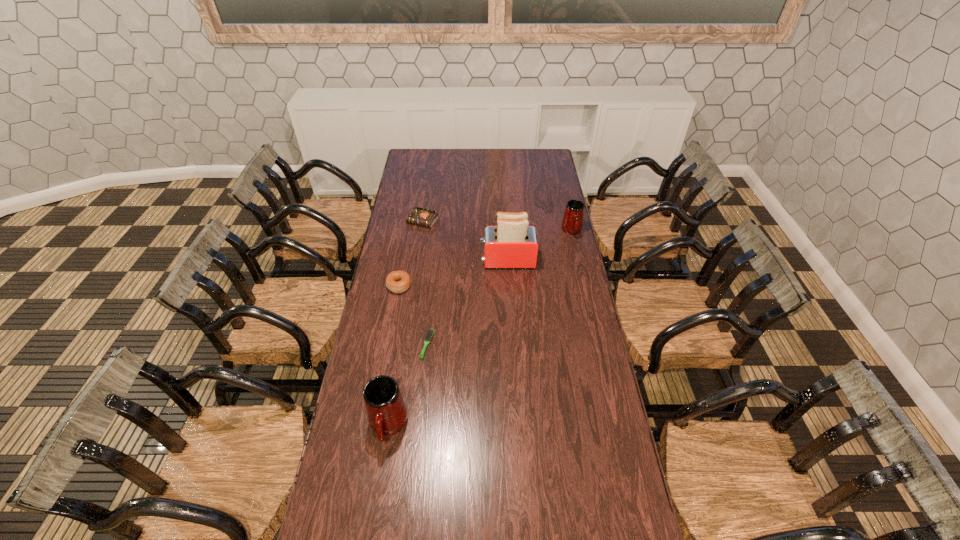
Find the location of a particular element. the nearer mug is located at coordinates (387, 414).

Find the location of a particular element. the second tallest object is located at coordinates (387, 414).

This screenshot has height=540, width=960. What are the coordinates of `the shorter mug` in the screenshot? It's located at (572, 223).

The height and width of the screenshot is (540, 960). I want to click on the farther mug, so click(572, 223).

This screenshot has width=960, height=540. Identify the location of toaster. (512, 244).

Image resolution: width=960 pixels, height=540 pixels. What are the coordinates of `the tallest object` in the screenshot? It's located at (512, 244).

Locate an element on the screen. diary is located at coordinates (419, 216).

Locate an element on the screen. This screenshot has height=540, width=960. bagel is located at coordinates (397, 281).

Image resolution: width=960 pixels, height=540 pixels. In order to click on the fifth farthest object in this screenshot , I will do `click(429, 333)`.

The image size is (960, 540). I want to click on the shortest object, so click(x=429, y=333).